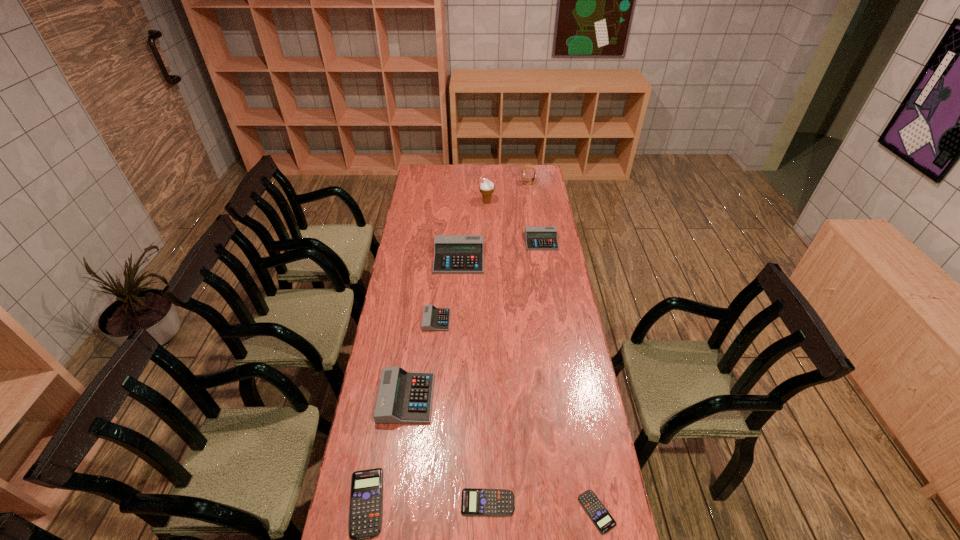
Where is `the fifth farthest object`? the fifth farthest object is located at coordinates (433, 319).

Locate an element on the screen. This screenshot has height=540, width=960. the second nearest gray calculator is located at coordinates (433, 319).

In order to click on the second blue calculator from left to right in this screenshot , I will do `click(475, 502)`.

In order to click on the eighth tallest object in this screenshot , I will do `click(475, 502)`.

In order to click on the shortest object in this screenshot , I will do `click(597, 512)`.

Locate an element on the screen. the shortest calculator is located at coordinates (597, 512).

Where is `vacant space situated on the back of the second farthest object`? vacant space situated on the back of the second farthest object is located at coordinates (487, 183).

Identify the location of vacant area situated 0.150m on the face of the watch. The image size is (960, 540). pyautogui.click(x=496, y=184).

I want to click on blank area located on the face of the watch, so click(x=479, y=184).

Locate an element on the screen. This screenshot has width=960, height=540. vacant space located on the face of the watch is located at coordinates (492, 184).